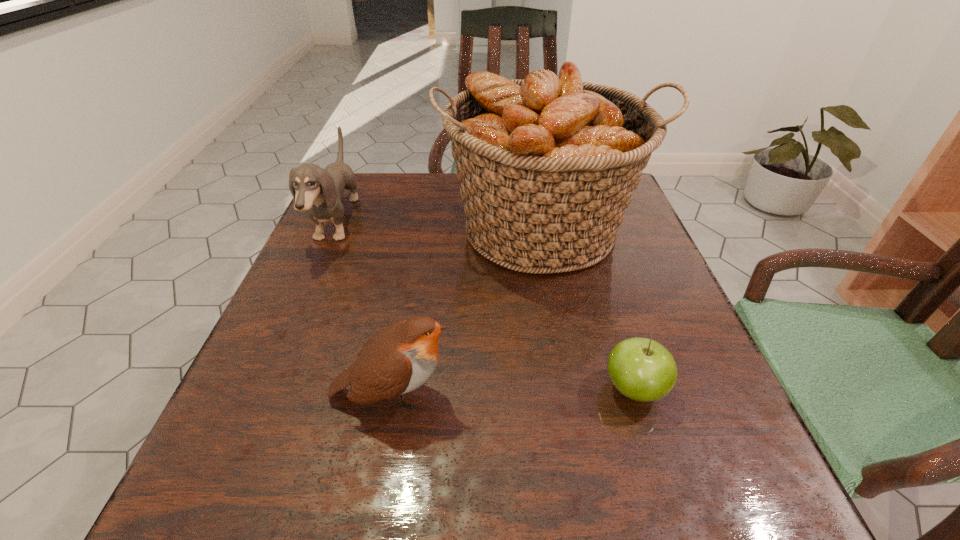
This screenshot has height=540, width=960. In order to click on free space that is in between the apple and the puppy in this screenshot , I will do `click(485, 306)`.

At what (x,y) coordinates should I click in order to perform the action: click on object that ranks as the second closest to the bird. Please return your answer as a coordinate pair (x, y). Looking at the image, I should click on (643, 370).

Point out which object is positioned as the third nearest to the bird. Please provide its 2D coordinates. Your answer should be formatted as a tuple, i.e. [(x, y)], where the tuple contains the x and y coordinates of a point satisfying the conditions above.

[(319, 191)]

Locate an element on the screen. The width and height of the screenshot is (960, 540). vacant point that satisfies the following two spatial constraints: 1. at the face of the puppy; 2. on the right side of the shortest object is located at coordinates (264, 389).

At what (x,y) coordinates should I click in order to perform the action: click on free space that satisfies the following two spatial constraints: 1. on the front side of the apple; 2. at the face of the bird. Please return your answer as a coordinate pair (x, y). This screenshot has height=540, width=960. Looking at the image, I should click on (636, 394).

Locate an element on the screen. vacant space that satisfies the following two spatial constraints: 1. at the face of the leftmost object; 2. on the left side of the apple is located at coordinates (264, 389).

Find the location of a particular element. This screenshot has height=540, width=960. free region that satisfies the following two spatial constraints: 1. on the back side of the shortest object; 2. at the face of the leftmost object is located at coordinates (583, 222).

Identify the location of vacant space that satisfies the following two spatial constraints: 1. on the front side of the basket; 2. on the right side of the apple. (570, 389).